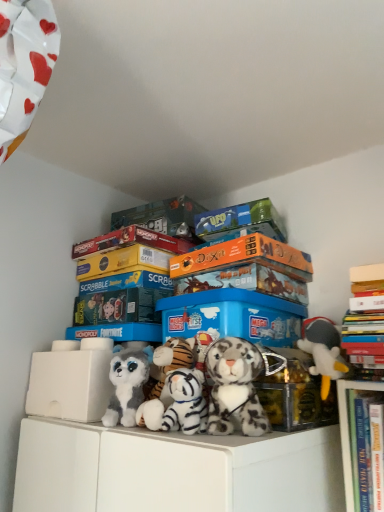
Question: Which direction should I rotate to look at metallic gold storage box at center, which is counted as the fourth storage box, starting from the left?

Choices:
 (A) left
 (B) right

Answer: (B)

Question: Can we say gray plush toy at right, which is the 1th toy from right to left, lies outside fluffy white tiger at center, which is counted as the 2th toy, starting from the right?

Choices:
 (A) yes
 (B) no

Answer: (A)

Question: Is fluffy white tiger at center, which is counted as the 2th toy, starting from the right, inside gray plush toy at right, the fourth toy positioned from the left?

Choices:
 (A) yes
 (B) no

Answer: (B)

Question: Is gray plush toy at right, which is the 1th toy from right to left, smaller than fluffy white tiger at center, which is counted as the 2th toy, starting from the right?

Choices:
 (A) yes
 (B) no

Answer: (A)

Question: Can you confirm if gray plush toy at right, the fourth toy positioned from the left, is taller than fluffy white tiger at center, which is counted as the 2th toy, starting from the right?

Choices:
 (A) yes
 (B) no

Answer: (A)

Question: Considering the relative sizes of gray plush toy at right, which is the 1th toy from right to left, and fluffy white tiger at center, which is counted as the 2th toy, starting from the right, in the image provided, is gray plush toy at right, which is the 1th toy from right to left, wider than fluffy white tiger at center, which is counted as the 2th toy, starting from the right,?

Choices:
 (A) no
 (B) yes

Answer: (A)

Question: Can you confirm if gray plush toy at right, which is the 1th toy from right to left, is bigger than fluffy white tiger at center, the third toy when ordered from left to right?

Choices:
 (A) yes
 (B) no

Answer: (B)

Question: Would you say gray plush toy at right, which is the 1th toy from right to left, is part of blue plastic storage box at center, placed as the third storage box when sorted from left to right,'s contents?

Choices:
 (A) yes
 (B) no

Answer: (B)

Question: Is blue plastic storage box at center, which is counted as the second storage box, starting from the right, in front of gray plush toy at right, which is the 1th toy from right to left?

Choices:
 (A) yes
 (B) no

Answer: (B)

Question: From the image's perspective, is blue plastic storage box at center, which is counted as the second storage box, starting from the right, over gray plush toy at right, the fourth toy positioned from the left?

Choices:
 (A) no
 (B) yes

Answer: (B)

Question: Considering the relative sizes of blue plastic storage box at center, which is counted as the second storage box, starting from the right, and gray plush toy at right, which is the 1th toy from right to left, in the image provided, is blue plastic storage box at center, which is counted as the second storage box, starting from the right, taller than gray plush toy at right, which is the 1th toy from right to left,?

Choices:
 (A) yes
 (B) no

Answer: (B)

Question: Is blue plastic storage box at center, which is counted as the second storage box, starting from the right, far from gray plush toy at right, the fourth toy positioned from the left?

Choices:
 (A) no
 (B) yes

Answer: (A)

Question: Is blue plastic storage box at center, which is counted as the second storage box, starting from the right, with gray plush toy at right, which is the 1th toy from right to left?

Choices:
 (A) no
 (B) yes

Answer: (A)

Question: Does white plush tiger at center, positioned as the second toy in left-to-right order, have a lesser height compared to blue plastic storage box at center, the second storage box positioned from the left?

Choices:
 (A) no
 (B) yes

Answer: (B)